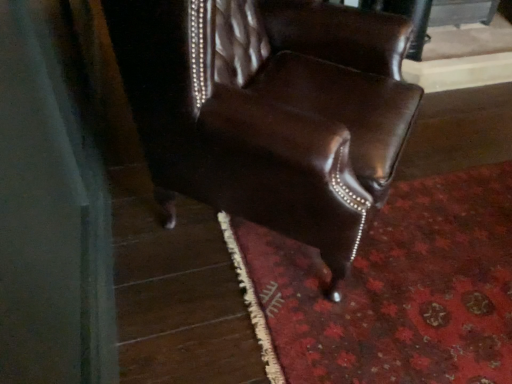
Question: Can you confirm if shiny brown leather chair at center is thinner than floral carpet at lower right?

Choices:
 (A) yes
 (B) no

Answer: (A)

Question: From a real-world perspective, does shiny brown leather chair at center sit lower than floral carpet at lower right?

Choices:
 (A) yes
 (B) no

Answer: (B)

Question: Does shiny brown leather chair at center have a smaller size compared to floral carpet at lower right?

Choices:
 (A) no
 (B) yes

Answer: (A)

Question: From the image's perspective, is shiny brown leather chair at center below floral carpet at lower right?

Choices:
 (A) yes
 (B) no

Answer: (B)

Question: From the image's perspective, is shiny brown leather chair at center located above floral carpet at lower right?

Choices:
 (A) no
 (B) yes

Answer: (B)

Question: Can you confirm if shiny brown leather chair at center is shorter than floral carpet at lower right?

Choices:
 (A) yes
 (B) no

Answer: (B)

Question: Would you consider floral carpet at lower right to be distant from shiny brown leather chair at center?

Choices:
 (A) yes
 (B) no

Answer: (B)

Question: Is floral carpet at lower right next to shiny brown leather chair at center?

Choices:
 (A) no
 (B) yes

Answer: (A)

Question: Does floral carpet at lower right have a greater width compared to shiny brown leather chair at center?

Choices:
 (A) no
 (B) yes

Answer: (B)

Question: Can you confirm if floral carpet at lower right is thinner than shiny brown leather chair at center?

Choices:
 (A) no
 (B) yes

Answer: (A)

Question: Considering the relative sizes of floral carpet at lower right and shiny brown leather chair at center in the image provided, is floral carpet at lower right bigger than shiny brown leather chair at center?

Choices:
 (A) no
 (B) yes

Answer: (A)

Question: Is floral carpet at lower right smaller than shiny brown leather chair at center?

Choices:
 (A) yes
 (B) no

Answer: (A)

Question: Considering the relative positions of shiny brown leather chair at center and floral carpet at lower right in the image provided, is shiny brown leather chair at center to the left or to the right of floral carpet at lower right?

Choices:
 (A) right
 (B) left

Answer: (B)